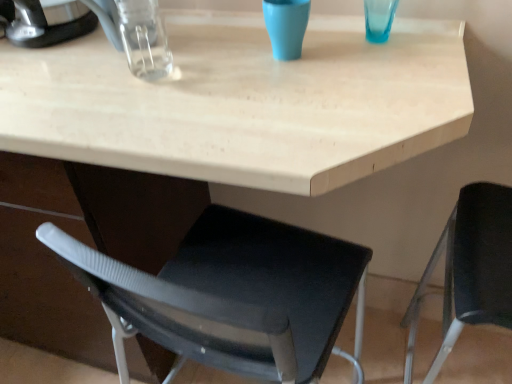
Describe the element at coordinates (44, 21) in the screenshot. Image resolution: width=512 pixels, height=384 pixels. I see `brushed metal coffee maker at upper left` at that location.

At what (x,y) coordinates should I click in order to perform the action: click on brushed metal coffee maker at upper left. Please return your answer as a coordinate pair (x, y). Looking at the image, I should click on click(44, 21).

Does brushed metal coffee maker at upper left appear on the right side of black plastic chair at right?

In fact, brushed metal coffee maker at upper left is to the left of black plastic chair at right.

Considering the sizes of brushed metal coffee maker at upper left and black plastic chair at right in the image, is brushed metal coffee maker at upper left taller or shorter than black plastic chair at right?

brushed metal coffee maker at upper left is shorter than black plastic chair at right.

From the image's perspective, is brushed metal coffee maker at upper left positioned above or below black plastic chair at right?

Based on their image positions, brushed metal coffee maker at upper left is located above black plastic chair at right.

Is point (72, 31) positioned in front of point (459, 309)?

No, (72, 31) is behind (459, 309).

Consider the image. Is black plastic chair at right bigger than matte blue cup at upper center?

Yes, black plastic chair at right is bigger than matte blue cup at upper center.

Which is in front, point (447, 266) or point (292, 14)?

The point (292, 14) is closer to the camera.

Is black plastic chair at right in contact with matte blue cup at upper center?

There is a gap between black plastic chair at right and matte blue cup at upper center.

Locate an element on the screen. This screenshot has height=384, width=512. chair below the matte blue cup at upper center (from a real-world perspective) is located at coordinates (469, 270).

Based on the photo, is matte blue cup at upper center taller or shorter than black plastic chair at right?

In the image, matte blue cup at upper center appears to be shorter than black plastic chair at right.

What's the angular difference between matte blue cup at upper center and black plastic chair at right's facing directions?

95.8 degrees.

Considering the positions of points (272, 38) and (405, 320), is point (272, 38) farther from camera compared to point (405, 320)?

That is False.

Based on the photo, considering the positions of objects matte blue cup at upper center and black plastic chair at right in the image provided, who is more to the right, matte blue cup at upper center or black plastic chair at right?

From the viewer's perspective, black plastic chair at right appears more on the right side.

Considering the positions of point (302, 7) and point (72, 10), is point (302, 7) closer or farther from the camera than point (72, 10)?

Clearly, point (302, 7) is closer to the camera than point (72, 10).

Is matte blue cup at upper center directly adjacent to brushed metal coffee maker at upper left?

There is a gap between matte blue cup at upper center and brushed metal coffee maker at upper left.

Which is correct: matte blue cup at upper center is inside brushed metal coffee maker at upper left, or outside of it?

matte blue cup at upper center cannot be found inside brushed metal coffee maker at upper left.

From a real-world perspective, is matte blue cup at upper center over brushed metal coffee maker at upper left?

No.

In the scene shown: Which is correct: brushed metal coffee maker at upper left is inside matte blue cup at upper center, or outside of it?

The correct answer is: outside.

From the image's perspective, is brushed metal coffee maker at upper left below matte blue cup at upper center?

Incorrect, from the image's perspective, brushed metal coffee maker at upper left is higher than matte blue cup at upper center.

Is brushed metal coffee maker at upper left smaller than matte blue cup at upper center?

No, brushed metal coffee maker at upper left is not smaller than matte blue cup at upper center.

Is black plastic chair at right positioned in front of brushed metal coffee maker at upper left?

Yes, black plastic chair at right is closer to the camera.

Measure the distance between black plastic chair at right and brushed metal coffee maker at upper left.

The distance of black plastic chair at right from brushed metal coffee maker at upper left is 38.26 inches.

From the image's perspective, does black plastic chair at right appear higher than brushed metal coffee maker at upper left?

No.

Can you confirm if black plastic chair at right is positioned to the left of brushed metal coffee maker at upper left?

No, black plastic chair at right is not to the left of brushed metal coffee maker at upper left.

The image size is (512, 384). Find the location of `chair in front of the brushed metal coffee maker at upper left`. chair in front of the brushed metal coffee maker at upper left is located at coordinates (469, 270).

The image size is (512, 384). What are the coordinates of `chair on the right of matte blue cup at upper center` in the screenshot? It's located at (469, 270).

Estimate the real-world distances between objects in this image. Which object is further from black plastic chair at right, matte blue cup at upper center or brushed metal coffee maker at upper left?

brushed metal coffee maker at upper left is positioned further to the anchor black plastic chair at right.

Based on their spatial positions, is brushed metal coffee maker at upper left or matte blue cup at upper center closer to black plastic chair at right?

matte blue cup at upper center.

Estimate the real-world distances between objects in this image. Which object is closer to matte blue cup at upper center, brushed metal coffee maker at upper left or black plastic chair at right?

brushed metal coffee maker at upper left is closer to matte blue cup at upper center.

Considering their positions, is black plastic chair at right positioned further to brushed metal coffee maker at upper left than matte blue cup at upper center?

black plastic chair at right is positioned further to the anchor brushed metal coffee maker at upper left.

Looking at the image, which one is located closer to brushed metal coffee maker at upper left, matte blue cup at upper center or black plastic chair at right?

matte blue cup at upper center is closer to brushed metal coffee maker at upper left.

When comparing their distances from matte blue cup at upper center, does black plastic chair at right or brushed metal coffee maker at upper left seem closer?

brushed metal coffee maker at upper left lies closer to matte blue cup at upper center than the other object.

Find the location of `clear between brushed metal coffee maker at upper left and black plastic chair at right`. clear between brushed metal coffee maker at upper left and black plastic chair at right is located at coordinates (286, 26).